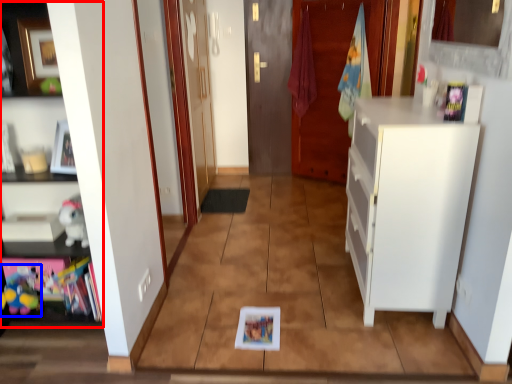
Question: Among these objects, which one is farthest to the camera, cabinetry (highlighted by a red box) or toy (highlighted by a blue box)?

Choices:
 (A) cabinetry
 (B) toy

Answer: (B)